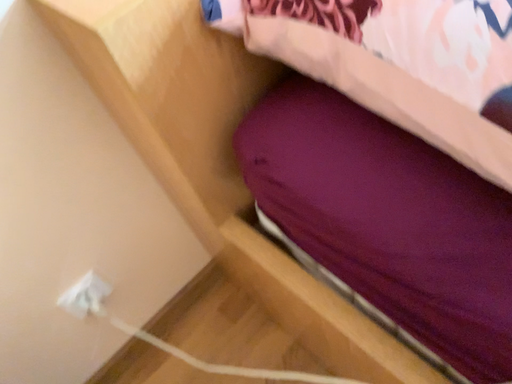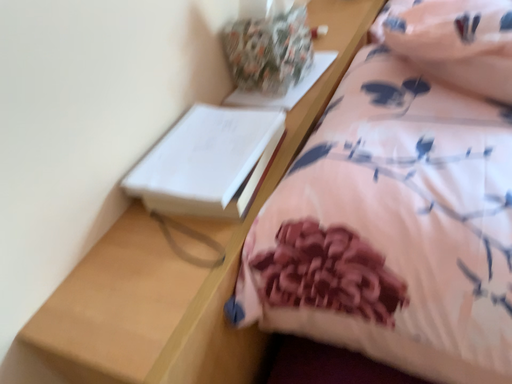
Question: How did the camera likely rotate when shooting the video?

Choices:
 (A) rotated right
 (B) rotated left

Answer: (A)